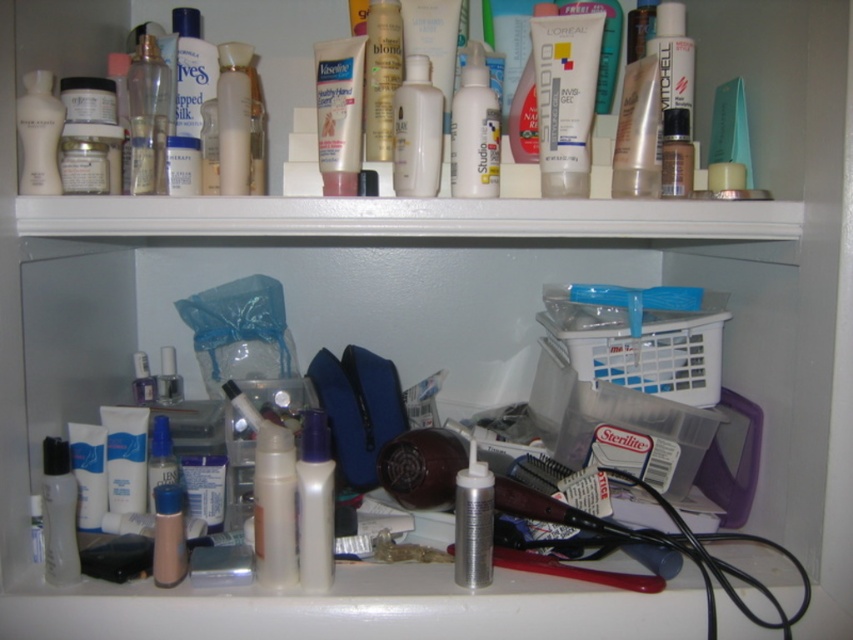
Question: Considering the real-world distances, which object is closest to the white matte spray bottle at upper center?

Choices:
 (A) translucent plastic lotion at center
 (B) white glossy lotion at upper center
 (C) matte white lotion at upper center

Answer: (B)

Question: Among these points, which one is nearest to the camera?

Choices:
 (A) (36, 74)
 (B) (469, 132)
 (C) (357, 113)

Answer: (A)

Question: Does silver metallic spray can at center appear under white matte bottle at upper left?

Choices:
 (A) no
 (B) yes

Answer: (B)

Question: Is white matte spray bottle at upper center further to camera compared to matte plastic bottle at upper center?

Choices:
 (A) no
 (B) yes

Answer: (A)

Question: Which object is closer to the camera taking this photo?

Choices:
 (A) white matte spray bottle at upper center
 (B) clear plastic nail polish at center
 (C) white glossy lotion at upper center

Answer: (C)

Question: Does matte white lotion at upper center appear under matte plastic bottle at upper center?

Choices:
 (A) no
 (B) yes

Answer: (A)